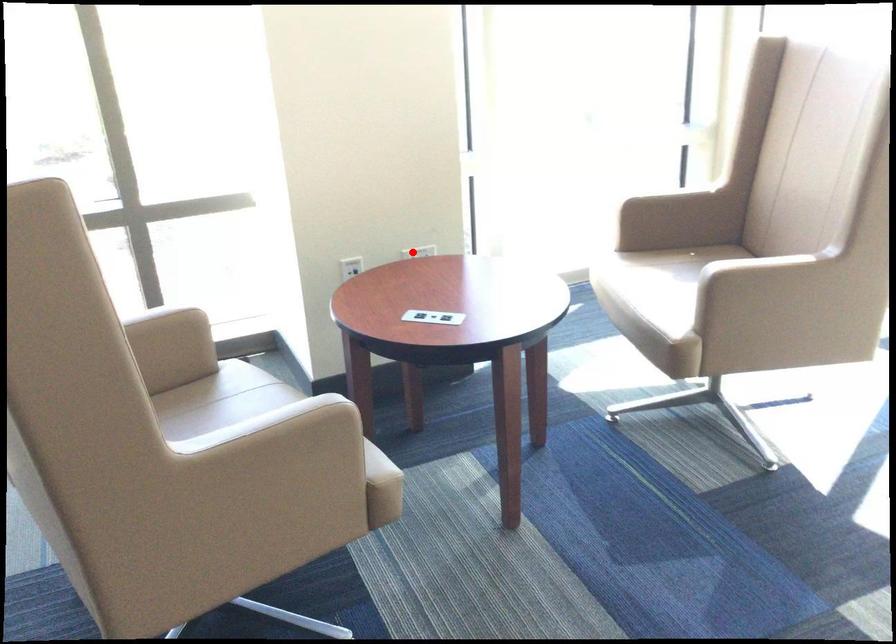
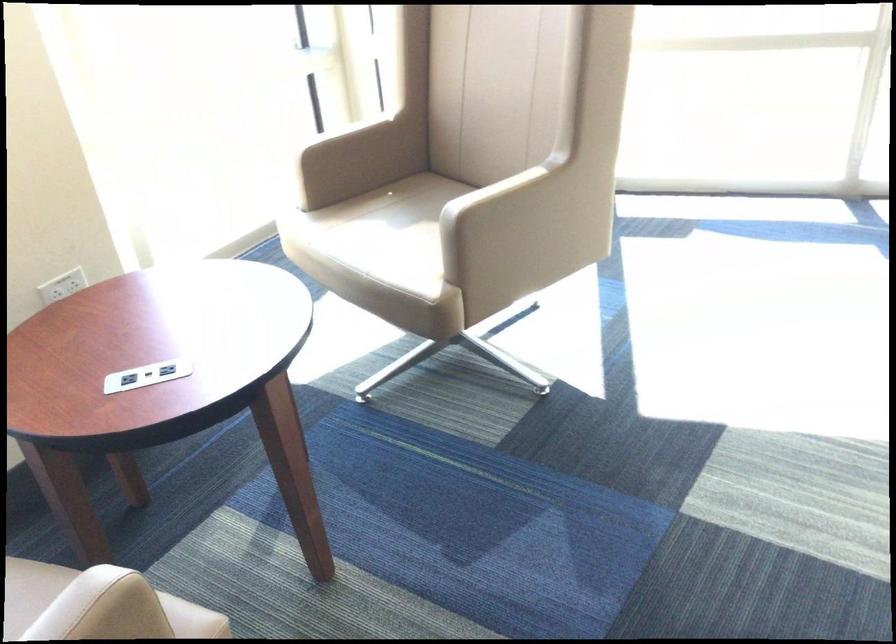
Where in the second image is the point corresponding to the highlighted location from the first image?

(62, 286)